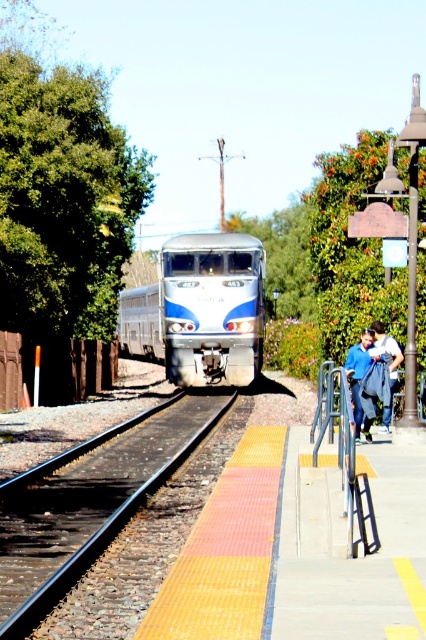
Which of these two, black metal track at center or denim jacket at right, stands taller?

denim jacket at right is taller.

Is black metal track at center bigger than denim jacket at right?

Yes, black metal track at center is bigger than denim jacket at right.

Between point (187, 449) and point (393, 372), which one is positioned behind?

The point (187, 449) is more distant.

Locate an element on the screen. The height and width of the screenshot is (640, 426). black metal track at center is located at coordinates (97, 541).

Is metallic gray rail at lower center thinner than denim jacket at right?

Incorrect, metallic gray rail at lower center's width is not less than denim jacket at right's.

Is metallic gray rail at lower center further to camera compared to denim jacket at right?

No, it is not.

Does point (333, 376) come farther from viewer compared to point (385, 348)?

No, (333, 376) is in front of (385, 348).

Locate an element on the screen. This screenshot has height=640, width=426. metallic gray rail at lower center is located at coordinates (344, 456).

Can you confirm if black metal track at center is positioned to the left of blue fabric jacket at right?

Indeed, black metal track at center is positioned on the left side of blue fabric jacket at right.

Is point (126, 508) less distant than point (379, 349)?

Yes, it is.

What are the coordinates of `black metal track at center` in the screenshot? It's located at coord(97,541).